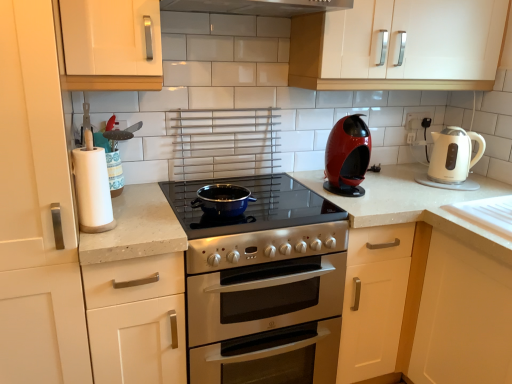
The image size is (512, 384). Find the location of `free space underneath red glossy coffee machine at center right, the first kitchen appliance in the left-to-right sequence (from a real-world perspective)`. free space underneath red glossy coffee machine at center right, the first kitchen appliance in the left-to-right sequence (from a real-world perspective) is located at coordinates click(x=348, y=188).